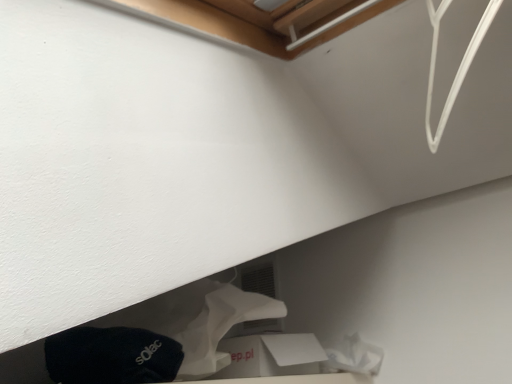
Image resolution: width=512 pixels, height=384 pixels. In order to click on white plastic wire at upper right in this screenshot , I will do `click(458, 68)`.

Image resolution: width=512 pixels, height=384 pixels. What do you see at coordinates (458, 68) in the screenshot? I see `white plastic wire at upper right` at bounding box center [458, 68].

Where is `white plastic wire at upper right`? This screenshot has height=384, width=512. white plastic wire at upper right is located at coordinates (458, 68).